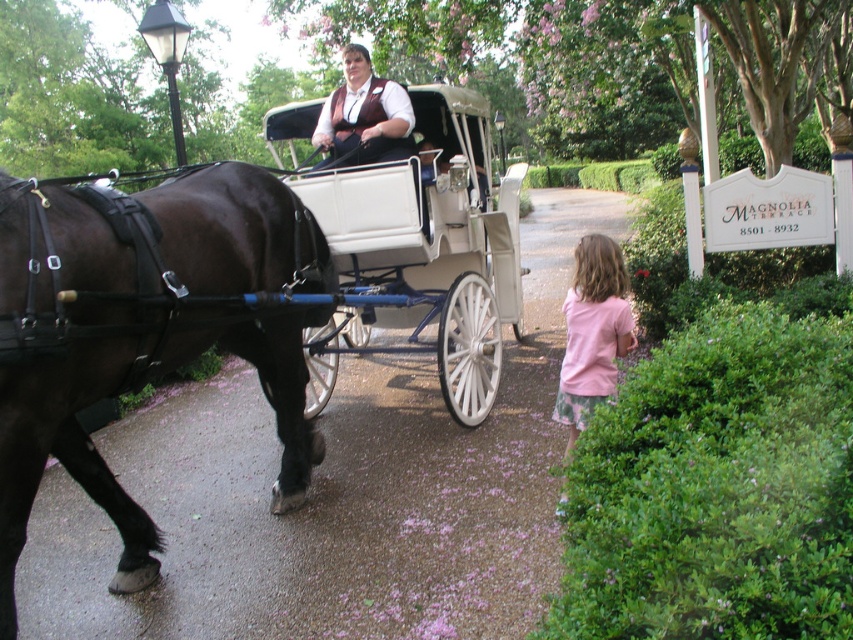
You are standing at the center of the scene and want to find the pink cotton shirt at lower right. In which direction should you look to locate it?

The pink cotton shirt at lower right is located at the lower right direction from your current position at the center of the scene.

You are a photographer trying to capture both the shiny black horse at left and the pink cotton shirt at lower right in a single shot. Since the horse is blocking the shirt, do you need to move the horse to the right or left to frame both properly?

The shiny black horse at left is positioned over pink cotton shirt at lower right, so moving the horse to the right would allow the pink cotton shirt at lower right to be visible in the frame.

In the scene described, there is a pink cotton shirt at lower right and a matte brown vest at center. From the perspective of an observer looking at the image, which object is positioned to the right of the other?

The pink cotton shirt at lower right is to the right of the matte brown vest at center.